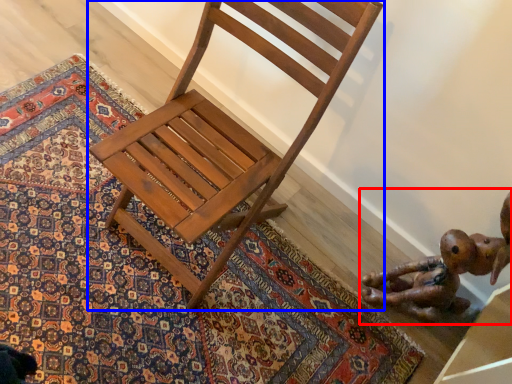
Question: Which object is further to the camera taking this photo, toy (highlighted by a red box) or chair (highlighted by a blue box)?

Choices:
 (A) toy
 (B) chair

Answer: (A)